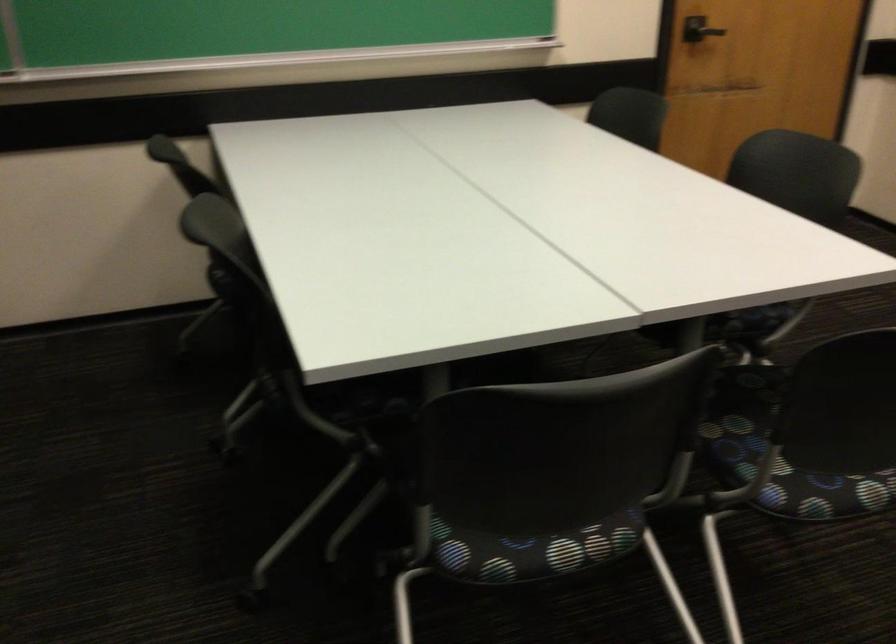
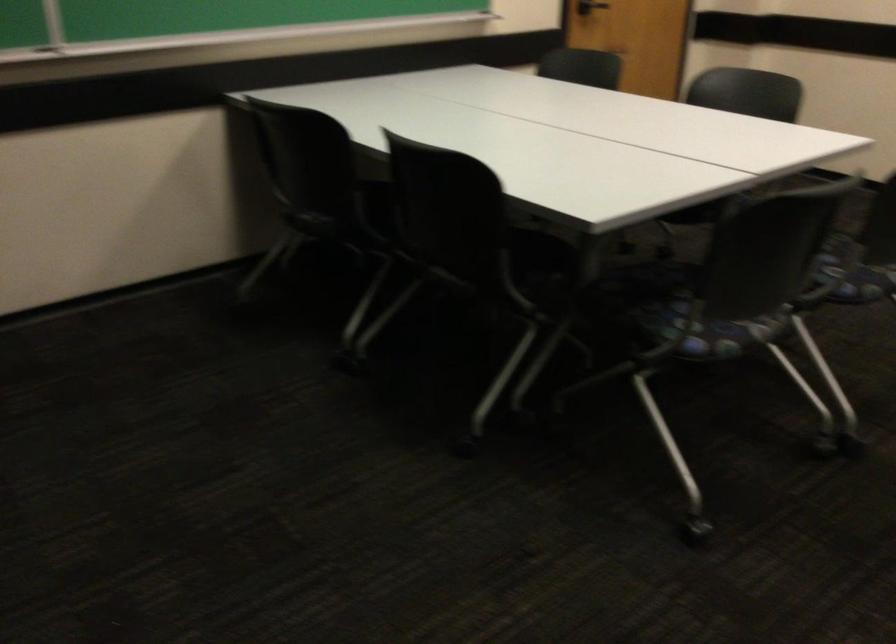
The point at (504, 538) is marked in the first image. Where is the corresponding point in the second image?

(719, 333)